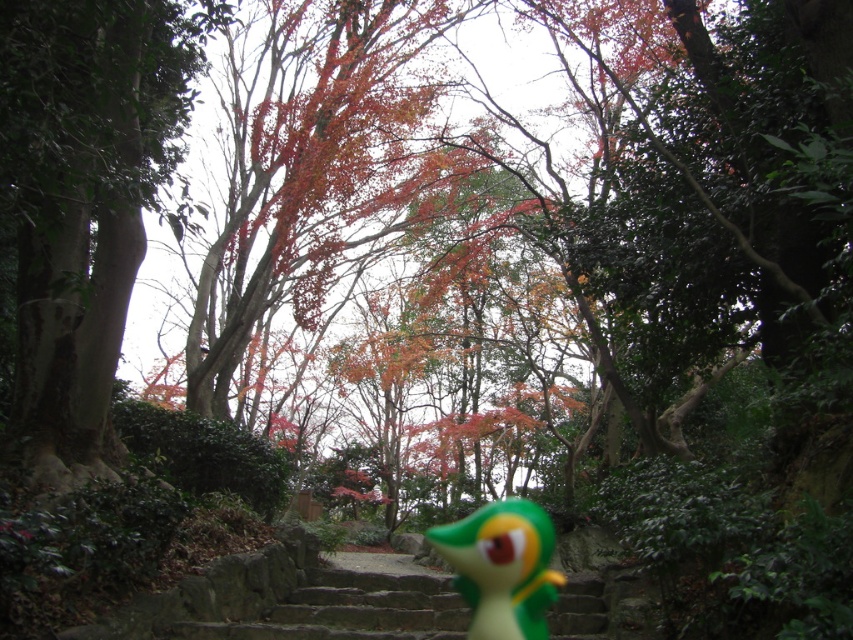
You are a hiker carrying a 2 meter long ladder. You need to place it between the green smooth tree trunk at left and the green rubber toy at center. Is there enough space for the ladder to be placed horizontally between them?

The distance between the green smooth tree trunk at left and the green rubber toy at center is 6.94 meters. Since the ladder is only 2 meters long, there is sufficient space to place it horizontally between them.